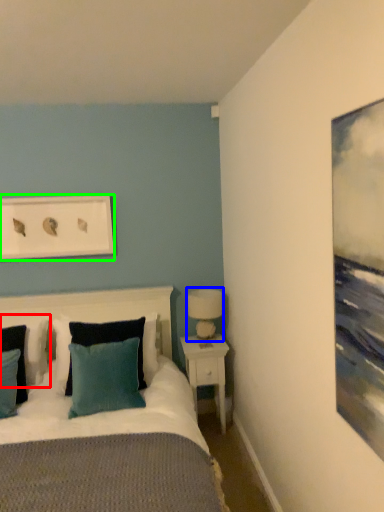
Question: Which is farther away from pillow (highlighted by a red box)? table lamp (highlighted by a blue box) or picture frame (highlighted by a green box)?

Choices:
 (A) table lamp
 (B) picture frame

Answer: (A)